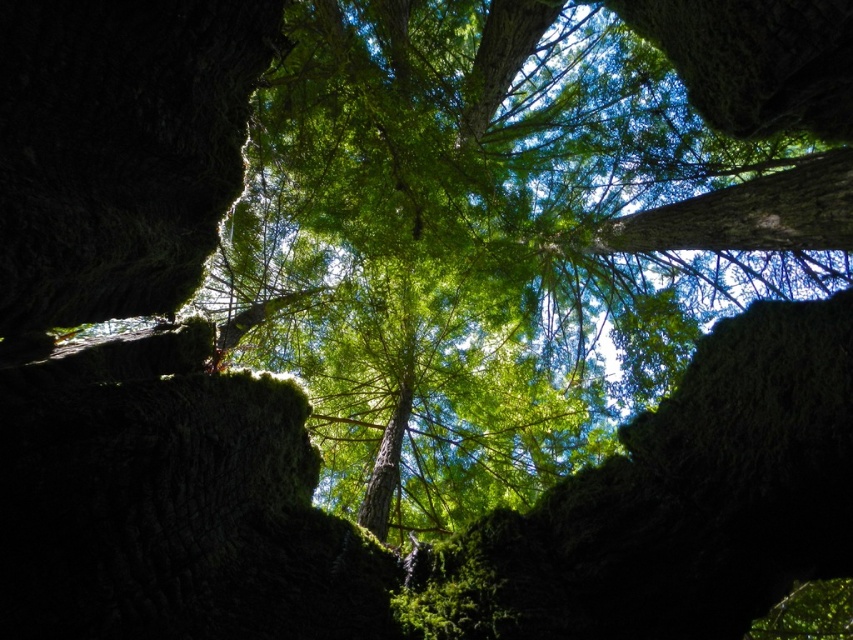
Question: Can you confirm if dark brown rough tree trunk at left is bigger than green rough bark tree trunk at center?

Choices:
 (A) yes
 (B) no

Answer: (A)

Question: Which object appears closest to the camera in this image?

Choices:
 (A) dark brown rough tree trunk at left
 (B) green rough bark tree trunk at center

Answer: (A)

Question: Can you confirm if dark brown rough tree trunk at left is positioned to the left of green rough bark tree trunk at center?

Choices:
 (A) no
 (B) yes

Answer: (B)

Question: Which point is closer to the camera?

Choices:
 (A) (378, 477)
 (B) (151, 100)

Answer: (B)

Question: Can you confirm if dark brown rough tree trunk at left is wider than green rough bark tree trunk at center?

Choices:
 (A) yes
 (B) no

Answer: (A)